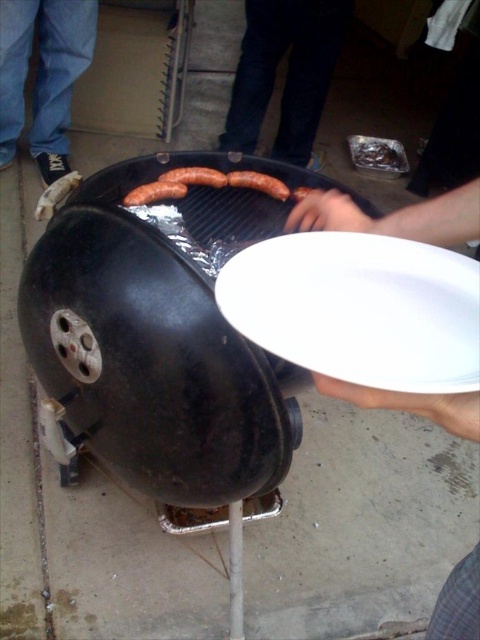
Question: Which object is positioned farthest from the jeans at lower left?

Choices:
 (A) white plastic plate at center
 (B) white matte plate at center

Answer: (A)

Question: Does white plastic plate at center appear under brown matte sausages at center?

Choices:
 (A) no
 (B) yes

Answer: (B)

Question: Does white plastic plate at center have a lesser width compared to shiny aluminum foil at upper right?

Choices:
 (A) yes
 (B) no

Answer: (A)

Question: Does jeans at lower left appear on the left side of smooth white sausage at center?

Choices:
 (A) no
 (B) yes

Answer: (B)

Question: Among these objects, which one is nearest to the camera?

Choices:
 (A) black matte grill at center
 (B) smooth white sausage at center
 (C) white matte plate at center

Answer: (C)

Question: Which of the following is the farthest from the observer?

Choices:
 (A) (475, 432)
 (B) (157, 177)
 (C) (159, 198)
 (D) (37, 29)

Answer: (D)